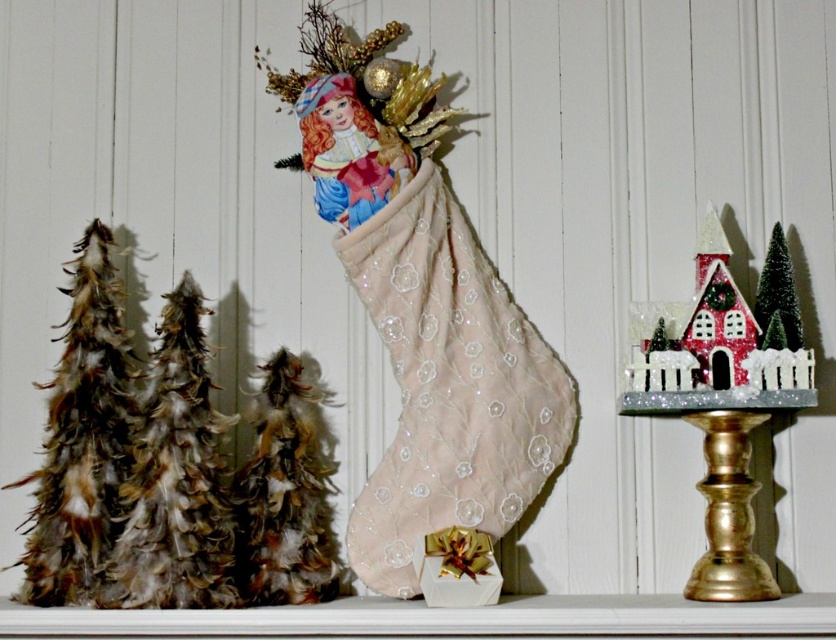
Is the position of feathered christmas tree at left more distant than that of green feathery christmas tree at right?

No, feathered christmas tree at left is in front of green feathery christmas tree at right.

Does feathered christmas tree at left appear on the left side of green feathery christmas tree at right?

Indeed, feathered christmas tree at left is positioned on the left side of green feathery christmas tree at right.

Is point (42, 563) less distant than point (766, 264)?

Yes, point (42, 563) is closer to viewer.

Locate an element on the screen. Image resolution: width=836 pixels, height=640 pixels. feathered christmas tree at left is located at coordinates (80, 435).

Which is below, feathered brown christmas trees at left or feathered brown christmas tree at left?

feathered brown christmas tree at left is below.

Is feathered brown christmas trees at left positioned in front of feathered brown christmas tree at left?

Yes, it is in front of feathered brown christmas tree at left.

This screenshot has height=640, width=836. Find the location of `feathered brown christmas trees at left`. feathered brown christmas trees at left is located at coordinates (176, 480).

The width and height of the screenshot is (836, 640). I want to click on feathered brown christmas trees at left, so click(x=176, y=480).

Which is behind, point (138, 552) or point (766, 296)?

Point (766, 296)

Looking at this image, does feathered brown christmas trees at left have a greater width compared to green feathery christmas tree at right?

Indeed, feathered brown christmas trees at left has a greater width compared to green feathery christmas tree at right.

Is point (179, 292) positioned behind point (788, 252)?

No, it is not.

In order to click on feathered brown christmas trees at left in this screenshot , I will do `click(176, 480)`.